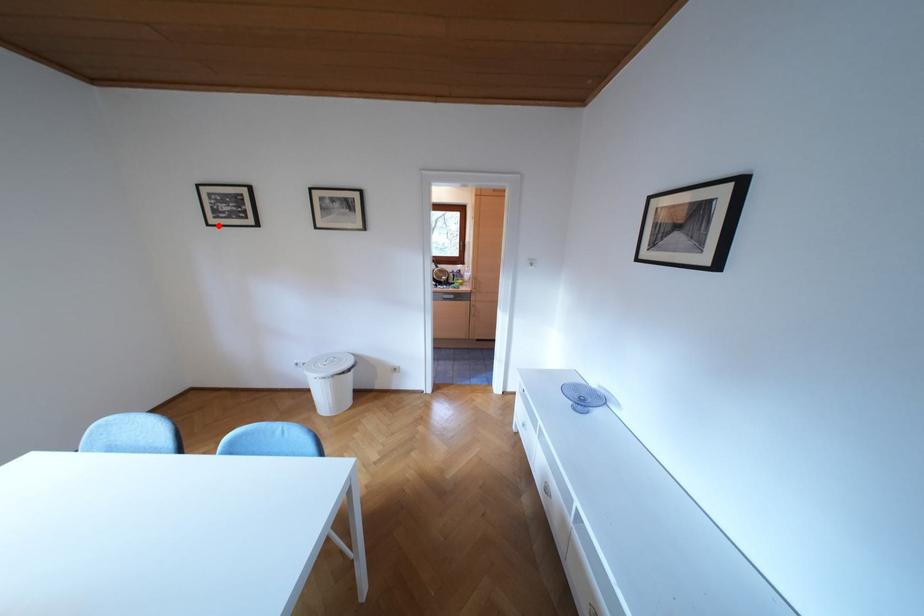
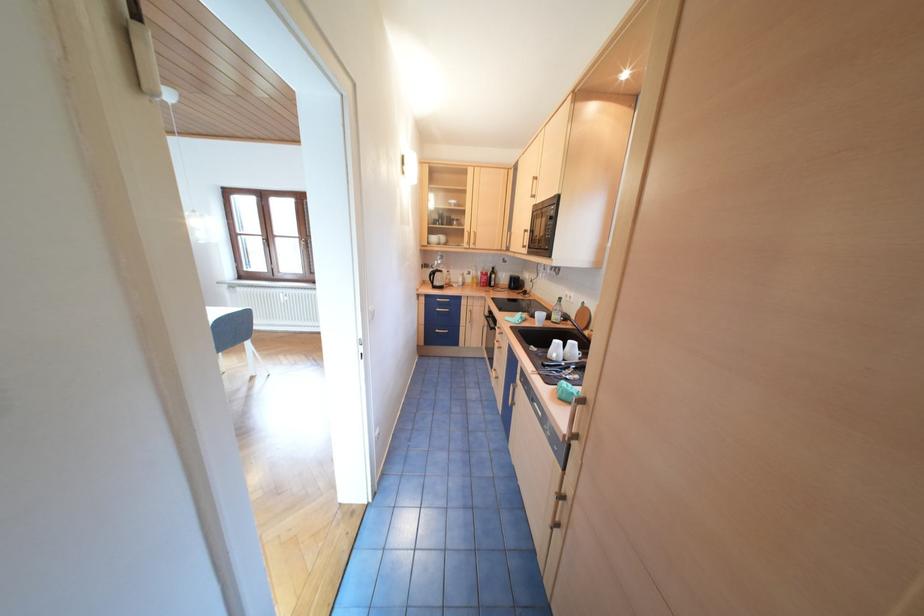
Question: I am providing you with two images of the same scene from different viewpoints. A red point is marked on the first image. At the location where the point appears in image 1, is it still visible in image 2?

Choices:
 (A) Yes
 (B) No

Answer: (B)